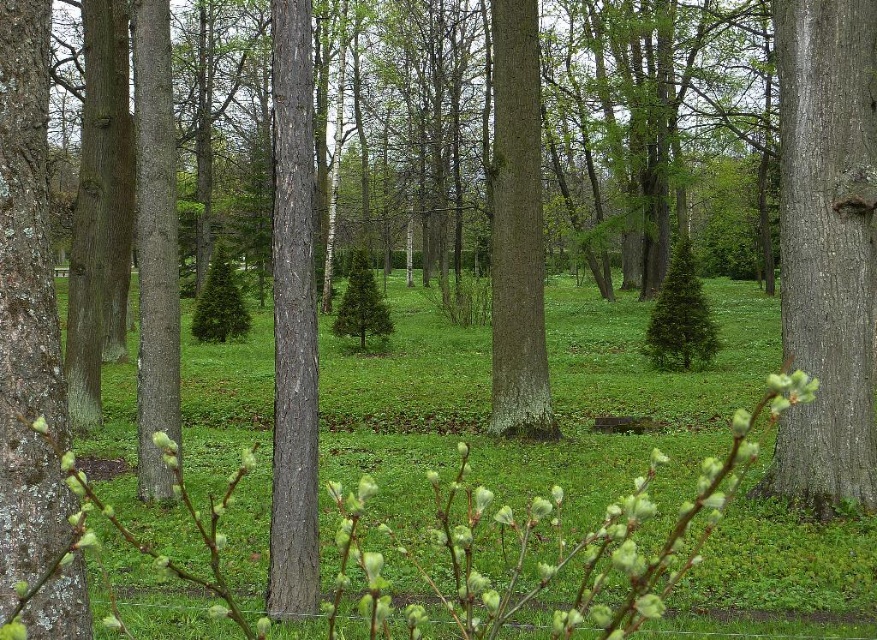
You are a hiker in the forest and want to identify the two tree trunks in the clearing. Which of the two trunks, the smooth brown tree trunk at center or the smooth bark tree trunk at center, is located to the left?

The smooth brown tree trunk at center is positioned on the left side of the smooth bark tree trunk at center, so it is located to the left.

You are a hiker who wants to place a 10 meter long tent between the green grassy at center and the smooth bark tree trunk at right. Is there enough space to set up the tent without it overlapping either of them?

The distance between the green grassy at center and the smooth bark tree trunk at right is 8.68 meters. Since the tent is 10 meters long, it would not fit between them as the available space is shorter than the tent.

From the picture: You are standing in the forest and want to place a small wooden bench. The bench requires a flat area at point [553,396]. According to the scene, is the ground at that point suitable for placing the bench?

The ground at point [553,396] is green grassy at center, which is flat enough to place the bench.